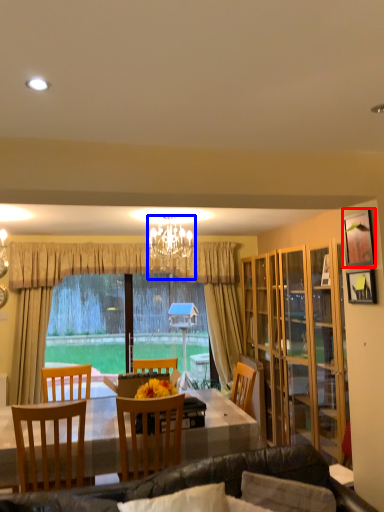
Question: Among these objects, which one is nearest to the camera, picture frame (highlighted by a red box) or lamp (highlighted by a blue box)?

Choices:
 (A) picture frame
 (B) lamp

Answer: (A)